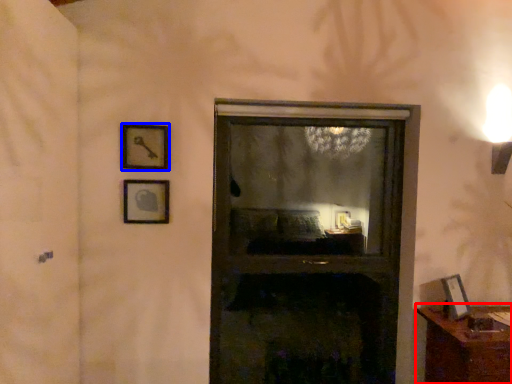
Question: Which object appears closest to the camera in this image, furniture (highlighted by a red box) or picture frame (highlighted by a blue box)?

Choices:
 (A) furniture
 (B) picture frame

Answer: (A)